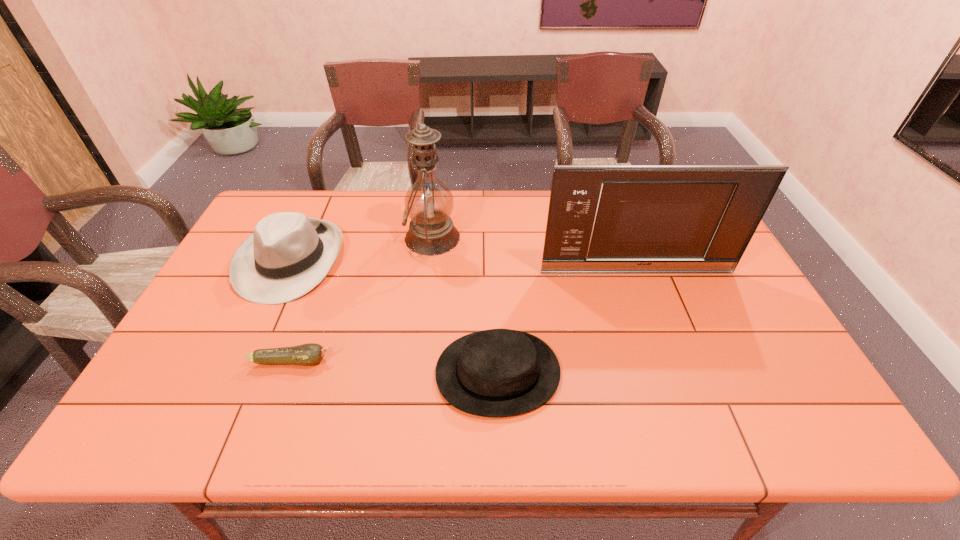
I want to click on vacant space at the right edge of the desktop, so click(x=708, y=302).

Locate an element on the screen. The height and width of the screenshot is (540, 960). empty location between the nearer fedora and the shortest object is located at coordinates (396, 367).

Find the location of `vacant area between the taller fedora and the microwave oven`. vacant area between the taller fedora and the microwave oven is located at coordinates (463, 266).

Find the location of a particular element. Image resolution: width=960 pixels, height=540 pixels. free space between the shorter fedora and the zucchini is located at coordinates (396, 367).

Identify the location of unoccupied position between the shortest object and the microwave oven. The image size is (960, 540). (465, 316).

At what (x,y) coordinates should I click in order to perform the action: click on empty space between the oil lamp and the nearer fedora. Please return your answer as a coordinate pair (x, y). This screenshot has width=960, height=540. Looking at the image, I should click on (465, 305).

Locate an element on the screen. This screenshot has height=540, width=960. free space between the zucchini and the microwave oven is located at coordinates (465, 316).

Identify the location of free spot between the microwave oven and the nearer fedora. This screenshot has height=540, width=960. (567, 322).

Identify the location of vacant region between the right fedora and the taller fedora. (394, 316).

Where is `free space between the microwave oven and the left fedora`? The width and height of the screenshot is (960, 540). free space between the microwave oven and the left fedora is located at coordinates (463, 266).